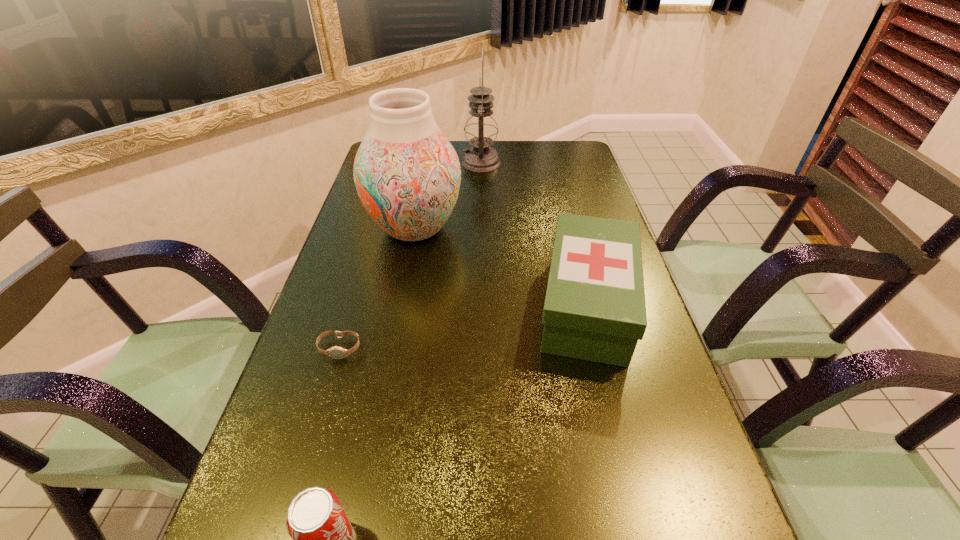
Where is `blank region between the rightmost object and the shortest object`? Image resolution: width=960 pixels, height=540 pixels. blank region between the rightmost object and the shortest object is located at coordinates (464, 327).

Where is `vacant area that lies between the farthest object and the shortest object`? vacant area that lies between the farthest object and the shortest object is located at coordinates (410, 256).

Locate which object ranks fourth in proximity to the first-aid kit. Please provide its 2D coordinates. Your answer should be formatted as a tuple, i.e. [(x, y)], where the tuple contains the x and y coordinates of a point satisfying the conditions above.

[(481, 129)]

The height and width of the screenshot is (540, 960). Identify the location of object that is the fourth closest one to the vase. (322, 536).

Find the location of `free location that satisfies the following two spatial constraints: 1. on the back side of the oil lamp; 2. on the left side of the vase`. free location that satisfies the following two spatial constraints: 1. on the back side of the oil lamp; 2. on the left side of the vase is located at coordinates (427, 163).